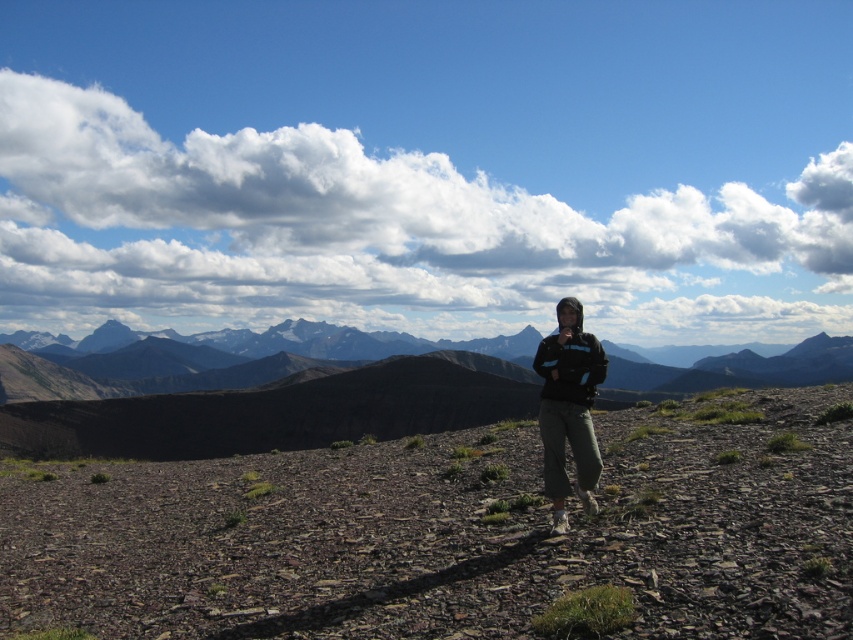
Question: Can you confirm if dull brown dirt at center is positioned below black fabric jacket at center?

Choices:
 (A) yes
 (B) no

Answer: (A)

Question: Can you confirm if dull brown dirt at center is thinner than black fabric jacket at center?

Choices:
 (A) yes
 (B) no

Answer: (B)

Question: Does dull brown dirt at center appear on the right side of black fabric jacket at center?

Choices:
 (A) no
 (B) yes

Answer: (A)

Question: Which point is farther from the camera taking this photo?

Choices:
 (A) (579, 342)
 (B) (784, 481)

Answer: (B)

Question: Which object appears closest to the camera in this image?

Choices:
 (A) black fabric jacket at center
 (B) dull brown dirt at center

Answer: (B)